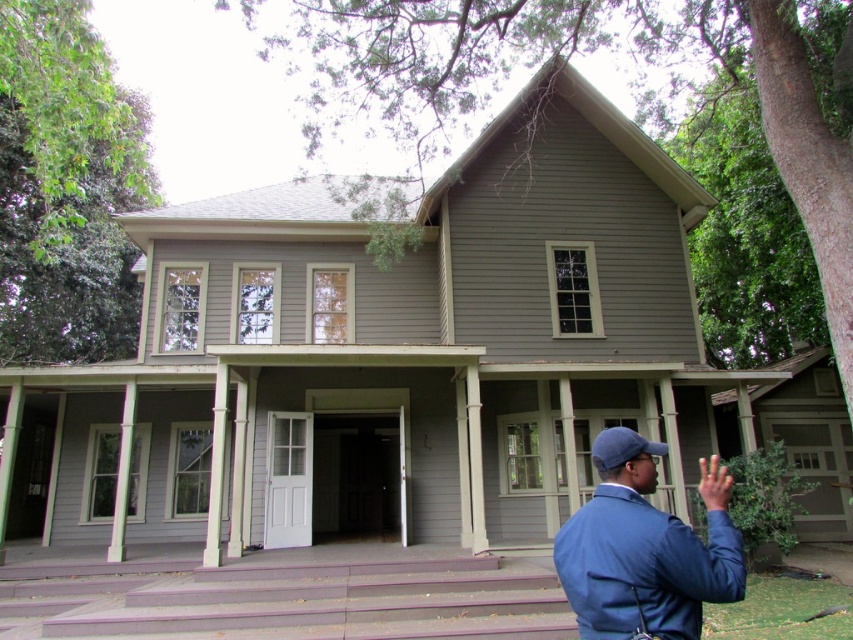
You are standing at the entrance of the house and want to walk towards the point labeled as point (x=683, y=580). Will you pass by point (x=665, y=445) before reaching your destination?

Yes, because point (x=683, y=580) is in front of point (x=665, y=445), so you will pass by point (x=665, y=445) first before reaching point (x=683, y=580).

You are standing on the lawn in front of the house and want to pick up the blue fabric jacket at lower right. Which direction should you move relative to the smooth gray porch at center?

Since the smooth gray porch at center is closer to you than the blue fabric jacket at lower right, you should move away from the smooth gray porch at center to reach the blue fabric jacket at lower right.